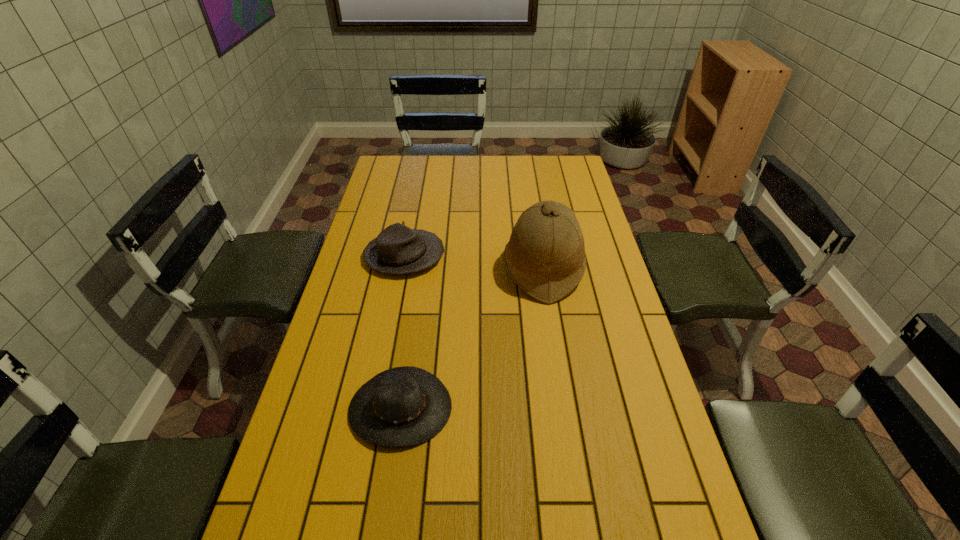
At what (x,y) coordinates should I click in order to perform the action: click on vacant space at the right edge of the desktop. Please return your answer as a coordinate pair (x, y). Looking at the image, I should click on (574, 312).

In order to click on vacant region between the tallest object and the nearest hat in this screenshot , I will do `click(471, 338)`.

Identify the location of object identified as the second closest to the tallest object. The image size is (960, 540). (403, 406).

Select which object is the second closest to the nearest object. Please provide its 2D coordinates. Your answer should be formatted as a tuple, i.e. [(x, y)], where the tuple contains the x and y coordinates of a point satisfying the conditions above.

[(398, 249)]

Where is `the second closest hat to the tallest hat`? The image size is (960, 540). the second closest hat to the tallest hat is located at coordinates (403, 406).

Locate an element on the screen. the closest hat relative to the rightmost object is located at coordinates (398, 249).

Where is `vacant position in the image that satisfies the following two spatial constraints: 1. on the front-facing side of the tallest object; 2. on the front-facing side of the nearest object`? The height and width of the screenshot is (540, 960). vacant position in the image that satisfies the following two spatial constraints: 1. on the front-facing side of the tallest object; 2. on the front-facing side of the nearest object is located at coordinates (564, 408).

Locate an element on the screen. The image size is (960, 540). vacant space that satisfies the following two spatial constraints: 1. on the front-facing side of the tallest hat; 2. on the front-facing side of the nearest object is located at coordinates point(564,408).